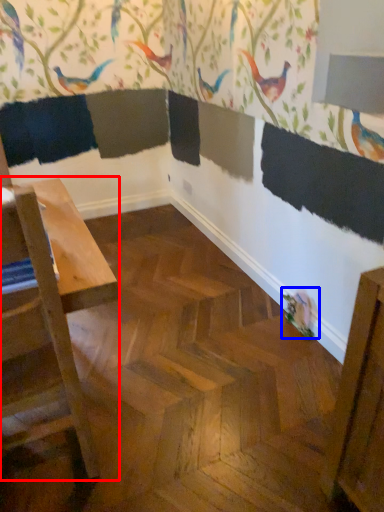
Question: Which object appears closest to the camera in this image, table (highlighted by a red box) or bird (highlighted by a blue box)?

Choices:
 (A) table
 (B) bird

Answer: (A)